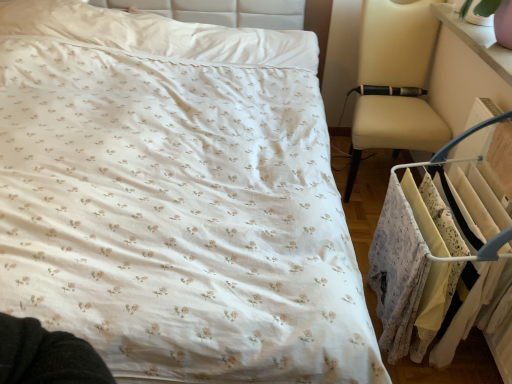
The height and width of the screenshot is (384, 512). Describe the element at coordinates (477, 40) in the screenshot. I see `pink glossy changing table at upper right` at that location.

At what (x,y) coordinates should I click in order to perform the action: click on pink glossy changing table at upper right. Please return your answer as a coordinate pair (x, y). The width and height of the screenshot is (512, 384). Looking at the image, I should click on (477, 40).

Locate an element on the screen. This screenshot has height=384, width=512. white fabric clothes at right is located at coordinates (420, 254).

The height and width of the screenshot is (384, 512). What do you see at coordinates (420, 254) in the screenshot? I see `white fabric clothes at right` at bounding box center [420, 254].

The width and height of the screenshot is (512, 384). I want to click on pink glossy changing table at upper right, so click(477, 40).

Between pink glossy changing table at upper right and white fabric clothes at right, which one appears on the left side from the viewer's perspective?

From the viewer's perspective, white fabric clothes at right appears more on the left side.

Is pink glossy changing table at upper right closer to the viewer compared to white fabric clothes at right?

No, pink glossy changing table at upper right is further to the viewer.

Is point (470, 24) farther from viewer compared to point (371, 259)?

Yes, point (470, 24) is behind point (371, 259).

From the image's perspective, between pink glossy changing table at upper right and white fabric clothes at right, which one is located above?

pink glossy changing table at upper right appears higher in the image.

From a real-world perspective, who is located lower, pink glossy changing table at upper right or white fabric clothes at right?

In real-world perspective, white fabric clothes at right is lower.

Can you confirm if pink glossy changing table at upper right is wider than white fabric clothes at right?

No.

Is pink glossy changing table at upper right taller than white fabric clothes at right?

In fact, pink glossy changing table at upper right may be shorter than white fabric clothes at right.

Does pink glossy changing table at upper right have a larger size compared to white fabric clothes at right?

No, pink glossy changing table at upper right is not bigger than white fabric clothes at right.

Is pink glossy changing table at upper right inside or outside of white fabric clothes at right?

pink glossy changing table at upper right is located beyond the bounds of white fabric clothes at right.

Is pink glossy changing table at upper right far from white fabric clothes at right?

pink glossy changing table at upper right is near white fabric clothes at right, not far away.

Is pink glossy changing table at upper right facing towards white fabric clothes at right?

No, pink glossy changing table at upper right is not turned towards white fabric clothes at right.

You are a GUI agent. You are given a task and a screenshot of the screen. Output one action in this format:
    pyautogui.click(x=<x>, y=<y>)
    Task: Click on the changing table above the white fabric clothes at right (from the image's perspective)
    
    Given the screenshot: What is the action you would take?
    pyautogui.click(x=477, y=40)

Considering the positions of objects white fabric clothes at right and pink glossy changing table at upper right in the image provided, who is more to the left, white fabric clothes at right or pink glossy changing table at upper right?

Positioned to the left is white fabric clothes at right.

Which is behind, white fabric clothes at right or pink glossy changing table at upper right?

pink glossy changing table at upper right is behind.

Considering the positions of point (382, 213) and point (462, 40), is point (382, 213) closer or farther from the camera than point (462, 40)?

Point (382, 213) is positioned closer to the camera compared to point (462, 40).

Consider the image. From the image's perspective, between white fabric clothes at right and pink glossy changing table at upper right, who is located below?

white fabric clothes at right is shown below in the image.

Looking at this image, from a real-world perspective, which is physically above, white fabric clothes at right or pink glossy changing table at upper right?

pink glossy changing table at upper right is physically above.

Does white fabric clothes at right have a lesser width compared to pink glossy changing table at upper right?

No.

Can you confirm if white fabric clothes at right is taller than pink glossy changing table at upper right?

Correct, white fabric clothes at right is much taller as pink glossy changing table at upper right.

Considering the relative sizes of white fabric clothes at right and pink glossy changing table at upper right in the image provided, is white fabric clothes at right smaller than pink glossy changing table at upper right?

Incorrect, white fabric clothes at right is not smaller in size than pink glossy changing table at upper right.

Does white fabric clothes at right contain pink glossy changing table at upper right?

No, pink glossy changing table at upper right is not inside white fabric clothes at right.

Is white fabric clothes at right beside pink glossy changing table at upper right?

No, white fabric clothes at right is not next to pink glossy changing table at upper right.

Could you tell me if white fabric clothes at right is turned towards pink glossy changing table at upper right?

No.

How different are the orientations of white fabric clothes at right and pink glossy changing table at upper right in degrees?

The angular difference between white fabric clothes at right and pink glossy changing table at upper right is 1.02 degrees.

Measure the distance between white fabric clothes at right and pink glossy changing table at upper right.

white fabric clothes at right and pink glossy changing table at upper right are 26.25 inches apart from each other.

The image size is (512, 384). I want to click on changing table that appears behind the white fabric clothes at right, so click(477, 40).

Locate an element on the screen. This screenshot has width=512, height=384. changing table above the white fabric clothes at right (from the image's perspective) is located at coordinates point(477,40).

Locate an element on the screen. changing table above the white fabric clothes at right (from a real-world perspective) is located at coordinates (477, 40).